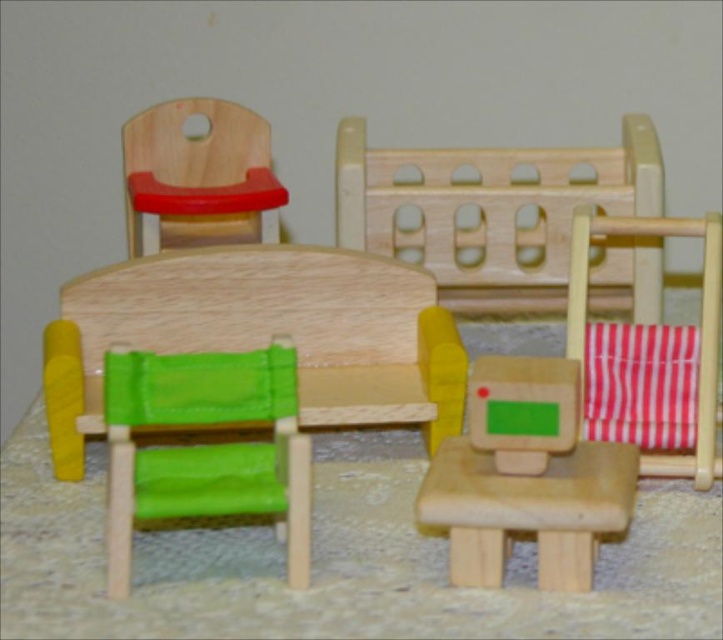
Who is higher up, matte wooden chair at center or green fabric chair at center?

green fabric chair at center is higher up.

Is matte wooden chair at center thinner than green fabric chair at center?

No, matte wooden chair at center is not thinner than green fabric chair at center.

The height and width of the screenshot is (640, 723). What do you see at coordinates (526, 476) in the screenshot?
I see `matte wooden chair at center` at bounding box center [526, 476].

You are a GUI agent. You are given a task and a screenshot of the screen. Output one action in this format:
    pyautogui.click(x=<x>, y=<y>)
    Task: Click on the matte wooden chair at center
    
    Given the screenshot: What is the action you would take?
    pyautogui.click(x=526, y=476)

Does point (134, 451) come in front of point (236, 180)?

Yes.

Who is higher up, green fabric chair at center or matte wood chair at upper left?

matte wood chair at upper left is higher up.

Which is behind, point (153, 381) or point (268, 145)?

The point (268, 145) is behind.

Where is `green fabric chair at center`? The width and height of the screenshot is (723, 640). green fabric chair at center is located at coordinates click(205, 448).

Between point (419, 296) and point (607, 529), which one is positioned in front?

Point (607, 529)

Can you confirm if green fabric table at center is wider than matte wooden chair at center?

Indeed, green fabric table at center has a greater width compared to matte wooden chair at center.

Where is `green fabric table at center`? green fabric table at center is located at coordinates (262, 333).